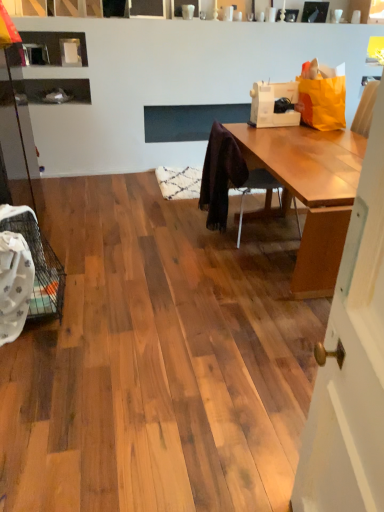
You are a GUI agent. You are given a task and a screenshot of the screen. Output one action in this format:
    pyautogui.click(x=<x>, y=<y>)
    Task: Click on the wooden chair at center
    The width and height of the screenshot is (384, 512).
    Given the screenshot: What is the action you would take?
    pyautogui.click(x=228, y=178)

Describe the element at coordinates (228, 178) in the screenshot. I see `wooden chair at center` at that location.

What is the approximate width of wooden chair at center?

It is 21.54 inches.

What do you see at coordinates (273, 104) in the screenshot?
I see `white plastic sewing machine at upper right` at bounding box center [273, 104].

What is the approximate width of white plastic sewing machine at upper right?

white plastic sewing machine at upper right is 7.16 inches wide.

Where is `white plastic sewing machine at upper right`? The height and width of the screenshot is (512, 384). white plastic sewing machine at upper right is located at coordinates (273, 104).

The width and height of the screenshot is (384, 512). Identify the location of wooden chair at center. (228, 178).

Is wooden chair at center to the right of white plastic sewing machine at upper right from the viewer's perspective?

No, wooden chair at center is not to the right of white plastic sewing machine at upper right.

Considering their positions, is wooden chair at center located in front of or behind white plastic sewing machine at upper right?

Visually, wooden chair at center is located in front of white plastic sewing machine at upper right.

Considering the positions of point (216, 200) and point (287, 91), is point (216, 200) closer or farther from the camera than point (287, 91)?

Point (216, 200) appears to be closer to the viewer than point (287, 91).

From the image's perspective, is wooden chair at center under white plastic sewing machine at upper right?

Correct, wooden chair at center appears lower than white plastic sewing machine at upper right in the image.

From a real-world perspective, is wooden chair at center positioned above or below white plastic sewing machine at upper right?

wooden chair at center is situated lower than white plastic sewing machine at upper right in the real world.

Considering the sizes of objects wooden chair at center and white plastic sewing machine at upper right in the image provided, who is thinner, wooden chair at center or white plastic sewing machine at upper right?

white plastic sewing machine at upper right.

From their relative heights in the image, would you say wooden chair at center is taller or shorter than white plastic sewing machine at upper right?

In the image, wooden chair at center appears to be taller than white plastic sewing machine at upper right.

Is wooden chair at center smaller than white plastic sewing machine at upper right?

Actually, wooden chair at center might be larger than white plastic sewing machine at upper right.

Is white plastic sewing machine at upper right inside wooden chair at center?

No.

Is wooden chair at center not near white plastic sewing machine at upper right?

Actually, wooden chair at center and white plastic sewing machine at upper right are a little close together.

Is wooden chair at center aimed at white plastic sewing machine at upper right?

No, wooden chair at center is not facing towards white plastic sewing machine at upper right.

How many degrees apart are the facing directions of wooden chair at center and white plastic sewing machine at upper right?

85.4 degrees separate the facing orientations of wooden chair at center and white plastic sewing machine at upper right.

Find the location of `sewing machine behind the wooden chair at center`. sewing machine behind the wooden chair at center is located at coordinates (273, 104).

Does white plastic sewing machine at upper right appear on the left side of wooden chair at center?

No, white plastic sewing machine at upper right is not to the left of wooden chair at center.

Which is in front, white plastic sewing machine at upper right or wooden chair at center?

wooden chair at center is more forward.

Is point (262, 97) more distant than point (225, 182)?

Yes.

From the image's perspective, relative to wooden chair at center, is white plastic sewing machine at upper right above or below?

white plastic sewing machine at upper right is above wooden chair at center.

From the picture: From a real-world perspective, is white plastic sewing machine at upper right positioned above or below wooden chair at center?

From a real-world perspective, white plastic sewing machine at upper right is physically above wooden chair at center.

Is white plastic sewing machine at upper right wider than wooden chair at center?

Incorrect, the width of white plastic sewing machine at upper right does not surpass that of wooden chair at center.

Between white plastic sewing machine at upper right and wooden chair at center, which one has less height?

Standing shorter between the two is white plastic sewing machine at upper right.

In terms of size, does white plastic sewing machine at upper right appear bigger or smaller than wooden chair at center?

white plastic sewing machine at upper right is smaller than wooden chair at center.

Is white plastic sewing machine at upper right inside the boundaries of wooden chair at center, or outside?

white plastic sewing machine at upper right is located beyond the bounds of wooden chair at center.

Is white plastic sewing machine at upper right not close to wooden chair at center?

That's not correct — white plastic sewing machine at upper right is a little close to wooden chair at center.

Is white plastic sewing machine at upper right oriented towards wooden chair at center?

No, white plastic sewing machine at upper right is not facing towards wooden chair at center.

What's the angular difference between white plastic sewing machine at upper right and wooden chair at center's facing directions?

85.4 degrees separate the facing orientations of white plastic sewing machine at upper right and wooden chair at center.

Where is `sewing machine above the wooden chair at center (from a real-world perspective)`? This screenshot has height=512, width=384. sewing machine above the wooden chair at center (from a real-world perspective) is located at coordinates pos(273,104).

Locate an element on the screen. chair below the white plastic sewing machine at upper right (from the image's perspective) is located at coordinates (228, 178).

Locate an element on the screen. chair below the white plastic sewing machine at upper right (from a real-world perspective) is located at coordinates (228, 178).